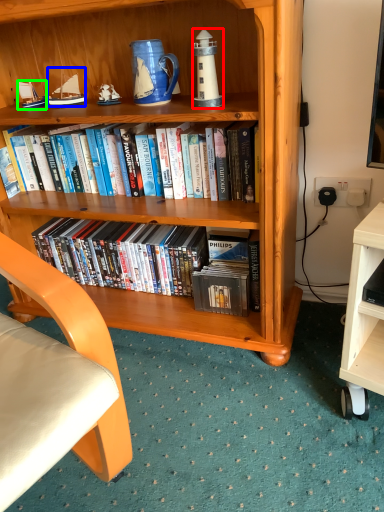
Question: Considering the real-world distances, which object is closest to lamp (highlighted by a red box)? sailboat (highlighted by a blue box) or sailboat (highlighted by a green box).

Choices:
 (A) sailboat
 (B) sailboat

Answer: (A)